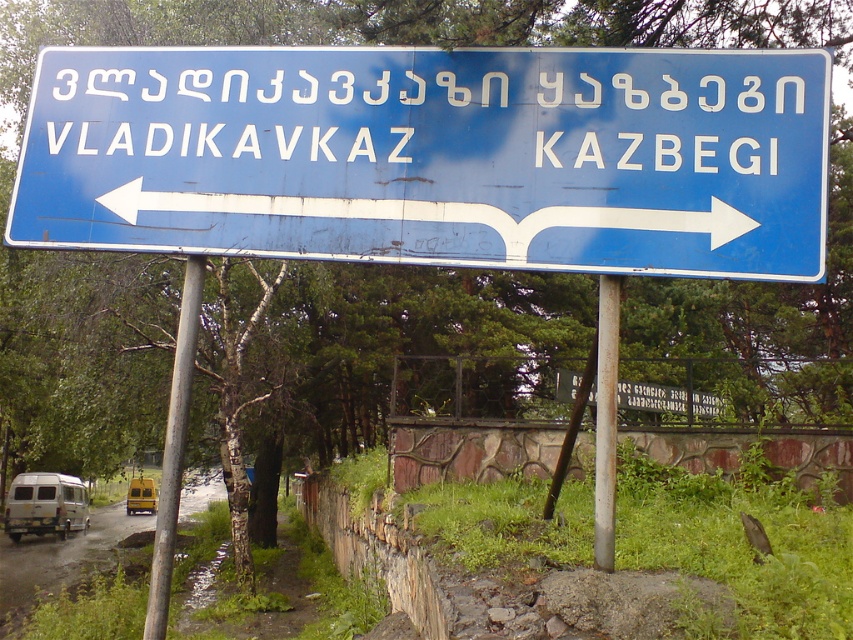
Does point (640, 400) come farther from viewer compared to point (152, 508)?

No.

Which is more to the right, white stone sign at center or yellow matte van at lower left?

white stone sign at center

Is point (674, 412) farther from camera compared to point (131, 509)?

No, (674, 412) is closer to viewer.

Where is `white stone sign at center`? white stone sign at center is located at coordinates (666, 397).

Is the position of blue metallic sign at center less distant than that of silver metallic pole at center?

Yes, it is in front of silver metallic pole at center.

Is blue metallic sign at center thinner than silver metallic pole at center?

In fact, blue metallic sign at center might be wider than silver metallic pole at center.

Which is behind, point (709, 154) or point (596, 429)?

Positioned behind is point (596, 429).

Identify the location of blue metallic sign at center. The width and height of the screenshot is (853, 640). (434, 156).

Does white glossy arrow at center have a smaller size compared to white stone sign at center?

Correct, white glossy arrow at center occupies less space than white stone sign at center.

At what (x,y) coordinates should I click in order to perform the action: click on white glossy arrow at center. Please return your answer as a coordinate pair (x, y). This screenshot has height=640, width=853. Looking at the image, I should click on (439, 212).